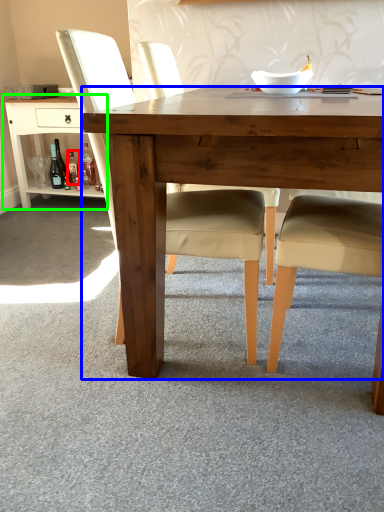
Question: Which is farther away from bottle (highlighted by a red box)? desk (highlighted by a blue box) or table (highlighted by a green box)?

Choices:
 (A) desk
 (B) table

Answer: (A)